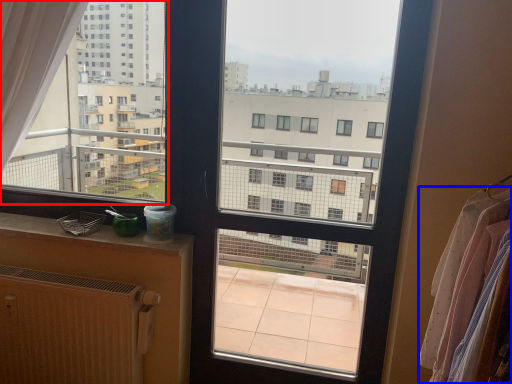
Question: Which object is further to the camera taking this photo, condominium (highlighted by a red box) or clothing (highlighted by a blue box)?

Choices:
 (A) condominium
 (B) clothing

Answer: (A)